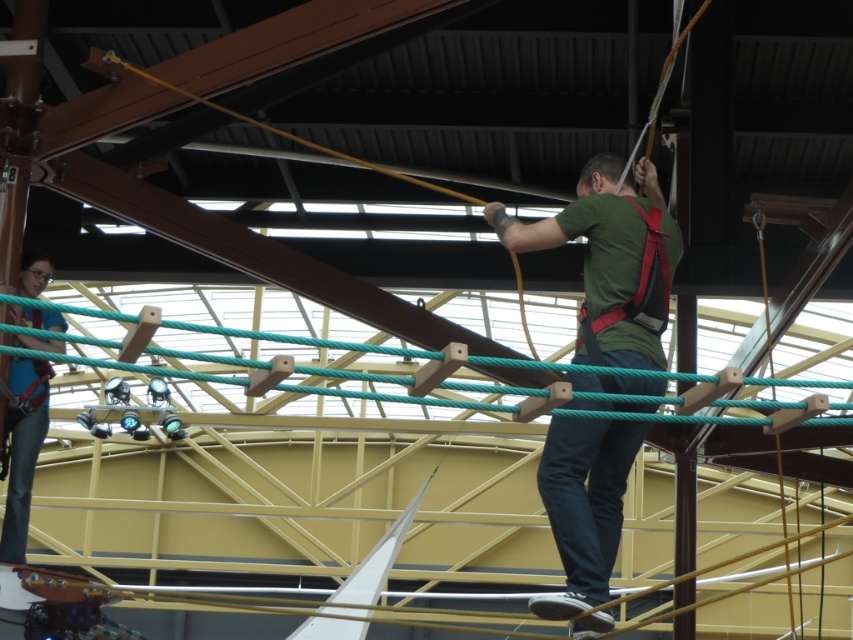
You are navigating an indoor climbing course and want to move from the point at coordinates point (576, 221) to the point at coordinates point (3, 548). Based on their positions, which direction should you move relative to the course structure?

You should move backward because point (576, 221) is in front of point (3, 548), so to reach the latter, you need to move in the opposite direction.

You are designing a new obstacle course and need to ensure that participants can move comfortably between the green matte shirt at center and the denim pants at lower left. Based on their widths, which object requires more horizontal space?

The green matte shirt at center might require more horizontal space since it might be wider than the denim pants at lower left according to the description.